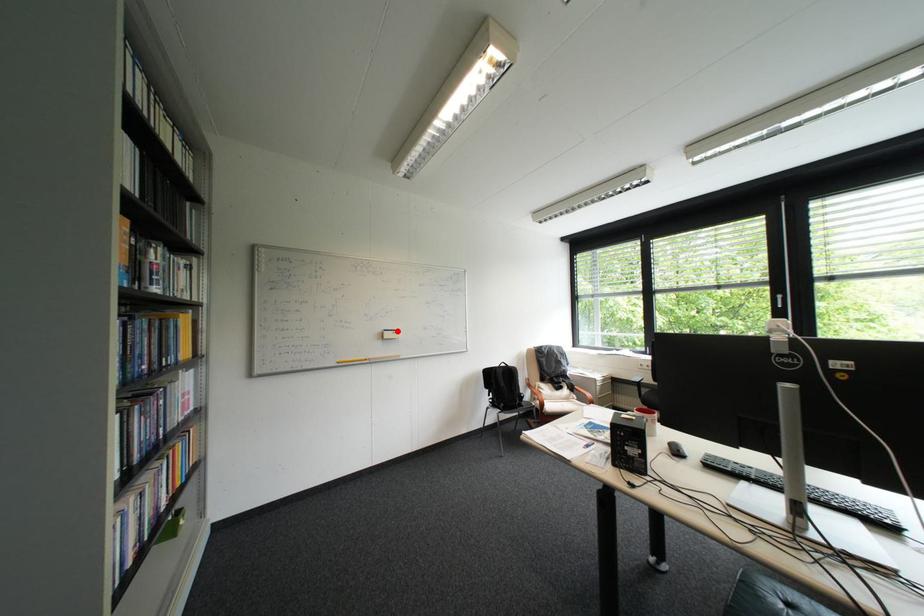
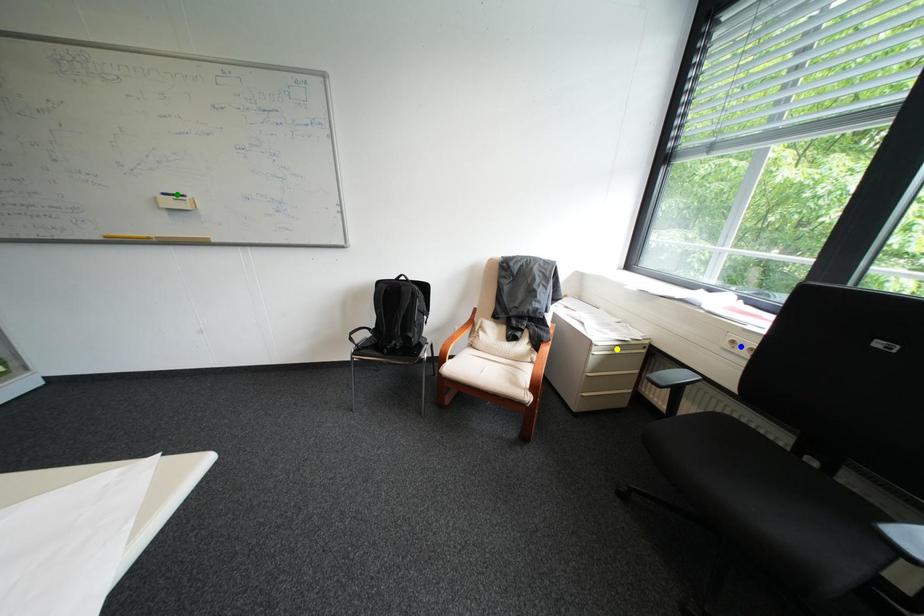
Question: I am providing you with two images of the same scene from different viewpoints. A red point is marked on the first image. You are given multiple points on the second image. In image 2, which mark is for the same physical point as the one in image 1?

Choices:
 (A) blue point
 (B) yellow point
 (C) green point

Answer: (C)